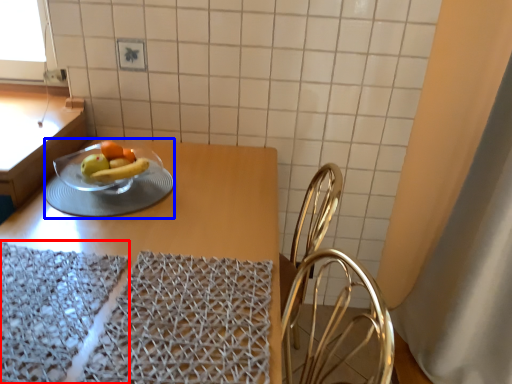
Question: Among these objects, which one is nearest to the camera, place mat (highlighted by a red box) or tableware (highlighted by a blue box)?

Choices:
 (A) place mat
 (B) tableware

Answer: (A)